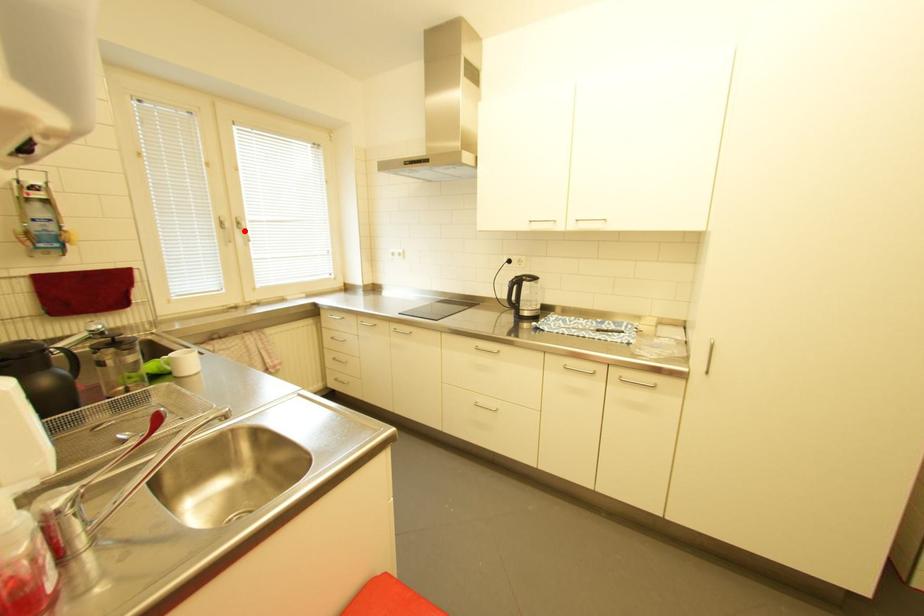
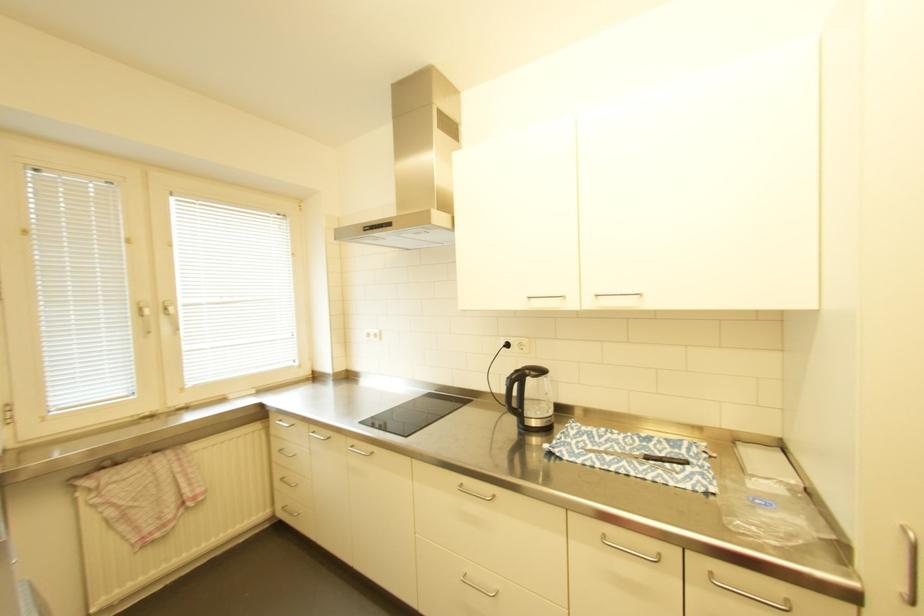
Find the pixel in the second image that matches the highlighted location in the first image.

(171, 318)